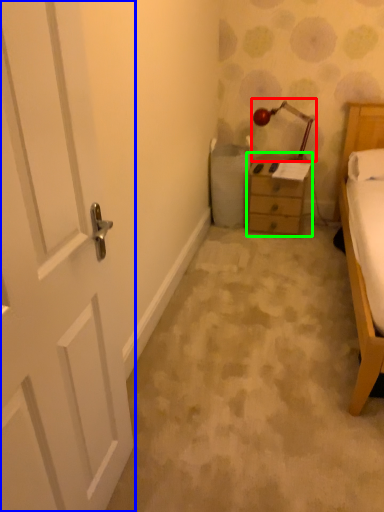
Question: Which object is the farthest from lamp (highlighted by a red box)? Choose among these: door (highlighted by a blue box) or nightstand (highlighted by a green box).

Choices:
 (A) door
 (B) nightstand

Answer: (A)